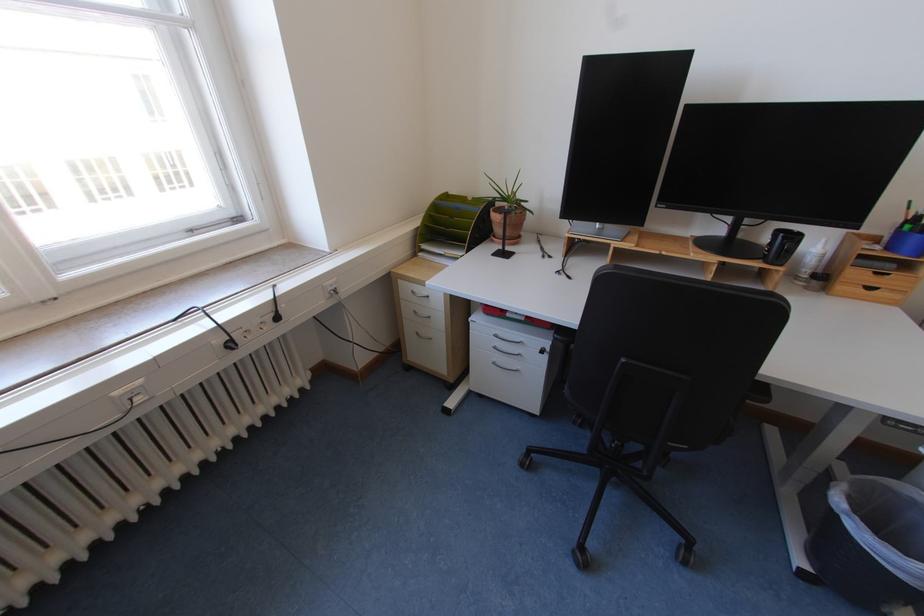
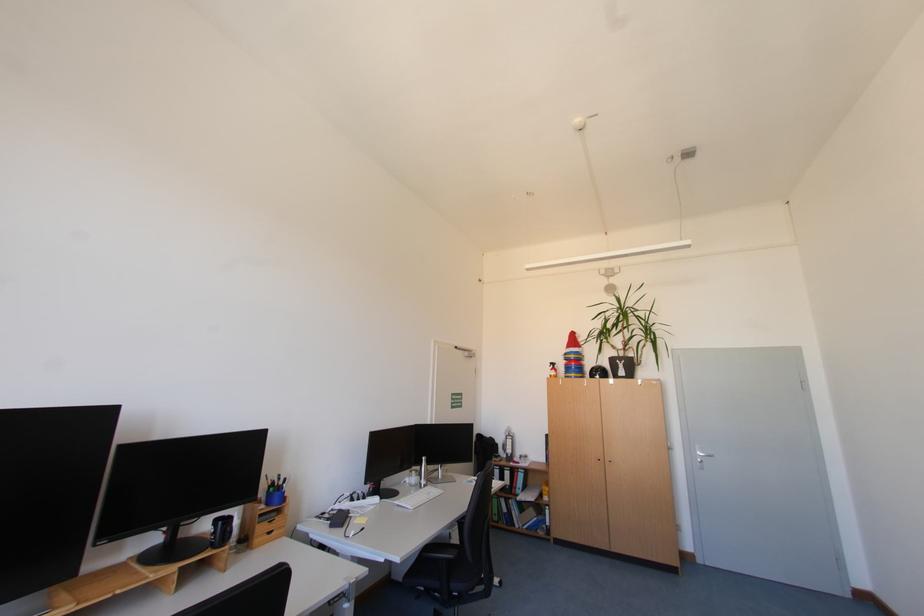
Question: The images are taken continuously from a first-person perspective. In which direction is your viewpoint rotating?

Choices:
 (A) Left
 (B) Right
 (C) Up
 (D) Down

Answer: (B)